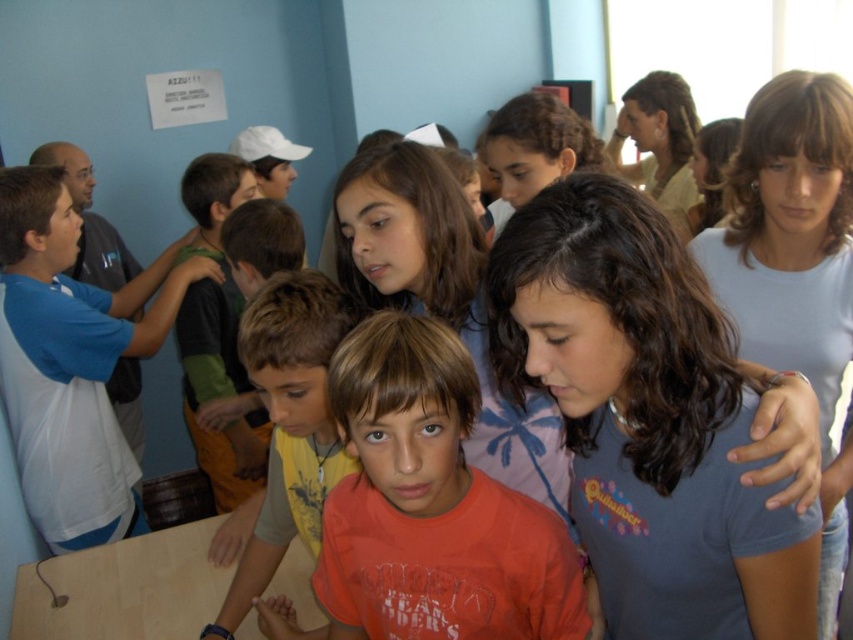
Is point (828, 445) closer to camera compared to point (196, 429)?

Yes.

Which is more to the left, light blue cotton shirt at center or green jersey at center?

Positioned to the left is green jersey at center.

Does point (770, 307) come behind point (206, 305)?

No, (770, 307) is closer to viewer.

At what (x,y) coordinates should I click in order to perform the action: click on light blue cotton shirt at center. Please return your answer as a coordinate pair (x, y). This screenshot has height=640, width=853. Looking at the image, I should click on (795, 266).

Is blue cotton shirt at center below orange t-shirt at center?

Actually, blue cotton shirt at center is above orange t-shirt at center.

Is point (618, 253) positioned before point (334, 465)?

Yes, point (618, 253) is closer to viewer.

What are the coordinates of `blue cotton shirt at center` in the screenshot? It's located at (645, 419).

Does blue cotton shirt at center come in front of white cotton shirt at left?

Yes, it is.

Does blue cotton shirt at center appear over white cotton shirt at left?

No.

At what (x,y) coordinates should I click in order to perform the action: click on blue cotton shirt at center. Please return your answer as a coordinate pair (x, y). This screenshot has width=853, height=640. Looking at the image, I should click on (645, 419).

You are a GUI agent. You are given a task and a screenshot of the screen. Output one action in this format:
    pyautogui.click(x=<x>, y=<y>)
    Task: Click on the blue cotton shirt at center
    This screenshot has width=853, height=640.
    Given the screenshot: What is the action you would take?
    pyautogui.click(x=645, y=419)